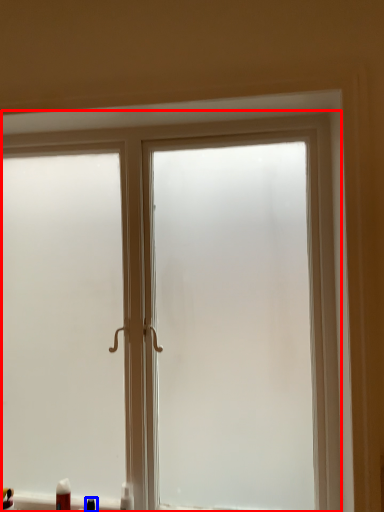
Question: Which object appears closest to the camera in this image, window (highlighted by a red box) or toiletry (highlighted by a blue box)?

Choices:
 (A) window
 (B) toiletry

Answer: (A)